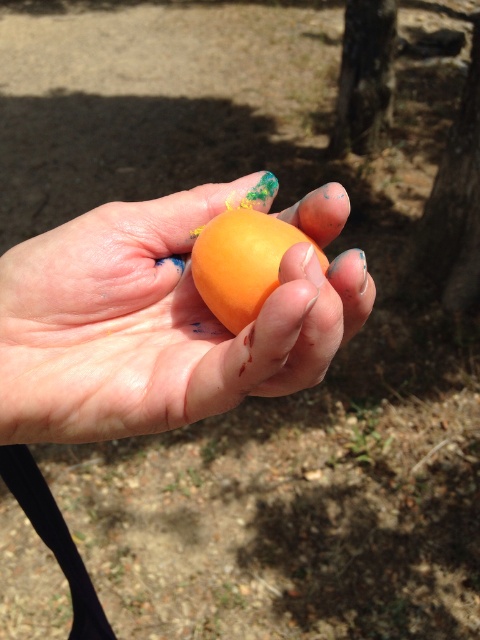
Question: Can you confirm if matte orange ball at center is positioned above smooth bark tree at upper center?

Choices:
 (A) yes
 (B) no

Answer: (B)

Question: Which of these objects is positioned closest to the smooth bark tree at center?

Choices:
 (A) orange matte/soft egg at center
 (B) matte orange ball at center
 (C) smooth bark tree at upper center

Answer: (C)

Question: Is matte orange ball at center positioned before smooth bark tree at upper center?

Choices:
 (A) yes
 (B) no

Answer: (A)

Question: Is smooth bark tree at center smaller than smooth bark tree at upper center?

Choices:
 (A) no
 (B) yes

Answer: (B)

Question: Which object is the farthest from the smooth bark tree at center?

Choices:
 (A) smooth bark tree at upper center
 (B) matte orange ball at center

Answer: (B)

Question: Which of the following is the closest to the observer?

Choices:
 (A) matte orange ball at center
 (B) orange matte/soft egg at center
 (C) smooth bark tree at center

Answer: (A)